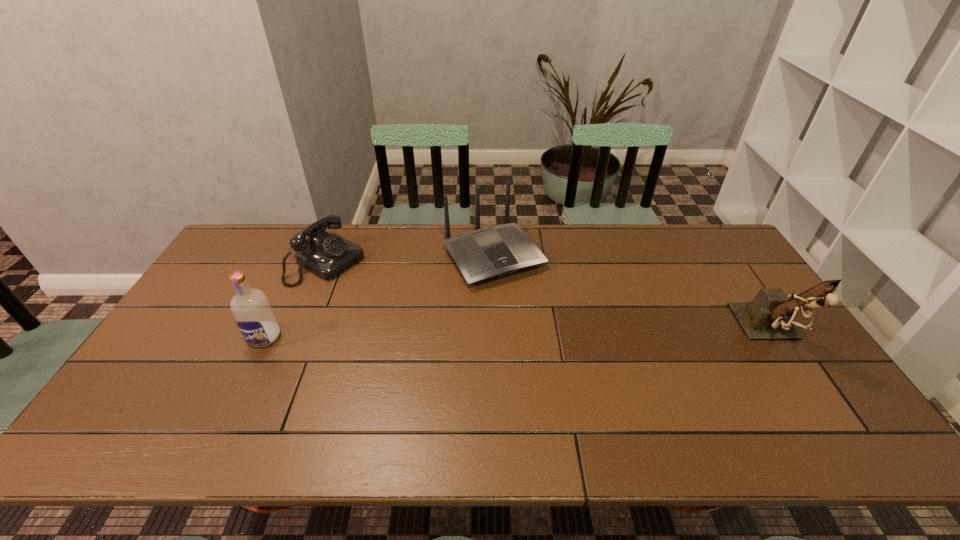
You are a GUI agent. You are given a task and a screenshot of the screen. Output one action in this format:
    pyautogui.click(x=<x>, y=<y>)
    Task: Click on the free space on the desktop that is between the vodka and the figurine and is positioned on the dial of the telephone
    The image size is (960, 540).
    Given the screenshot: What is the action you would take?
    pyautogui.click(x=456, y=335)

This screenshot has width=960, height=540. Find the location of `free space on the desktop that is between the vodka and the figurine and is positioned on the front-facing side of the router`. free space on the desktop that is between the vodka and the figurine and is positioned on the front-facing side of the router is located at coordinates (551, 335).